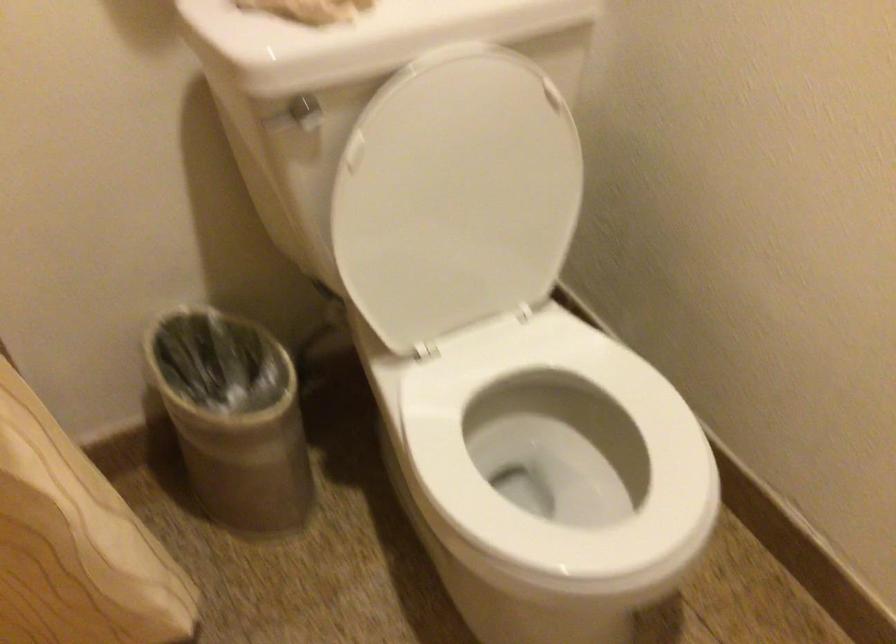
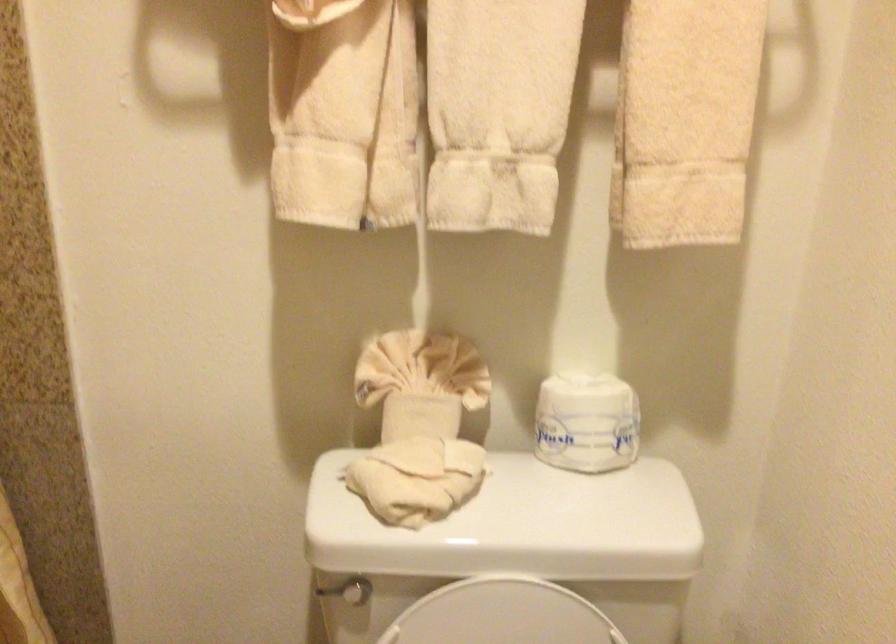
The first image is from the beginning of the video and the second image is from the end. How did the camera likely rotate when shooting the video?

The camera's rotation is toward left-up.